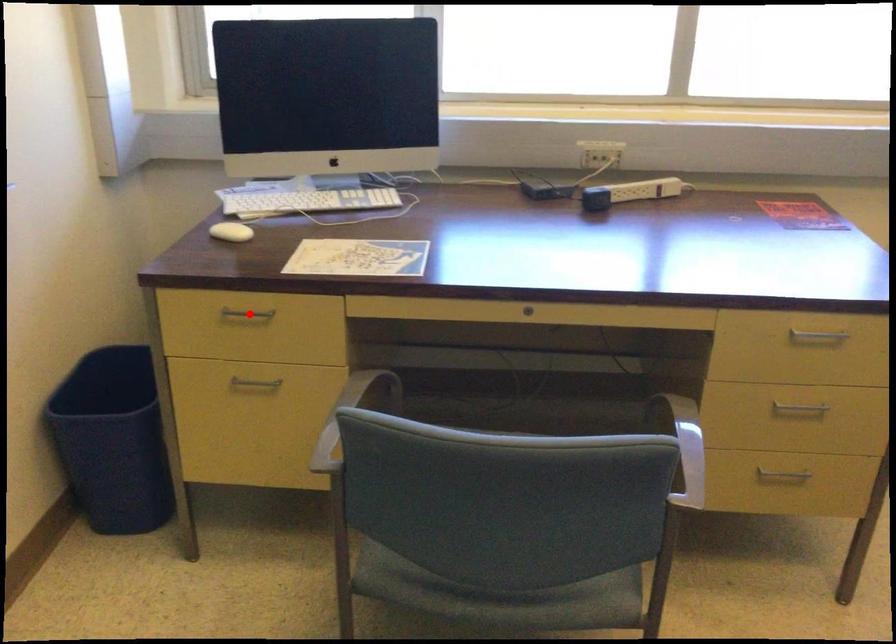
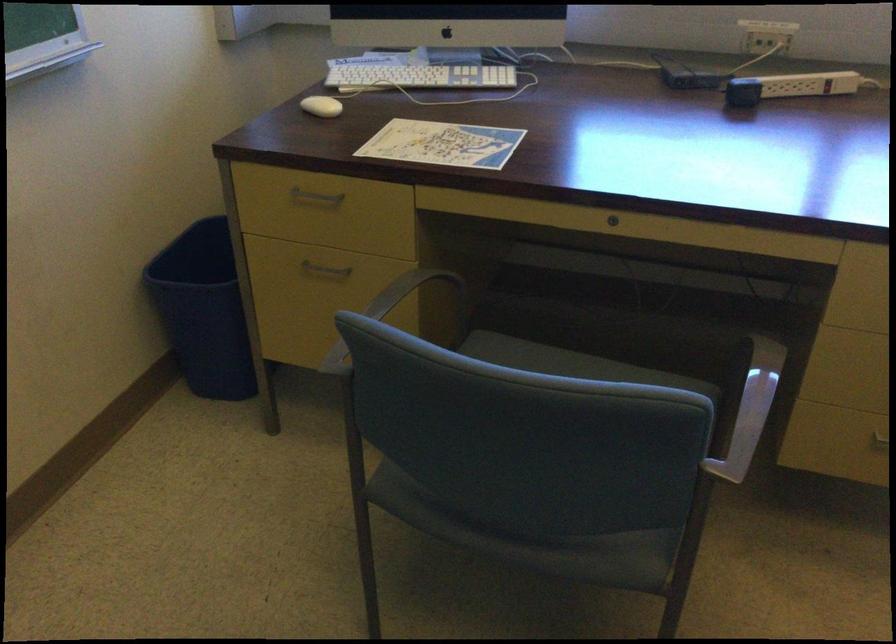
Find the pixel in the second image that matches the highlighted location in the first image.

(315, 196)